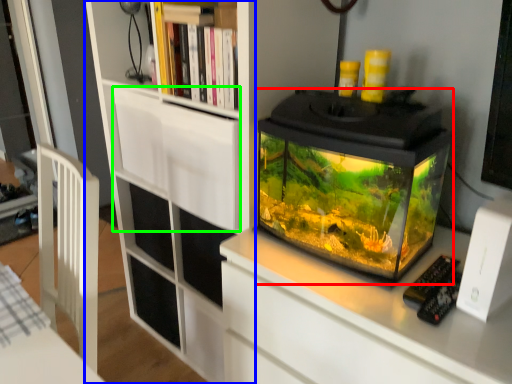
Question: Considering the real-world distances, which object is closest to glass box (highlighted by a red box)? bookcase (highlighted by a blue box) or drawer (highlighted by a green box).

Choices:
 (A) bookcase
 (B) drawer

Answer: (B)